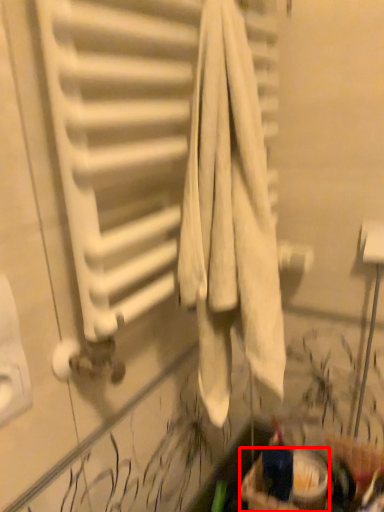
Question: From the image's perspective, what is the correct spatial positioning of basket (annotated by the red box) in reference to radiator?

Choices:
 (A) below
 (B) above

Answer: (A)